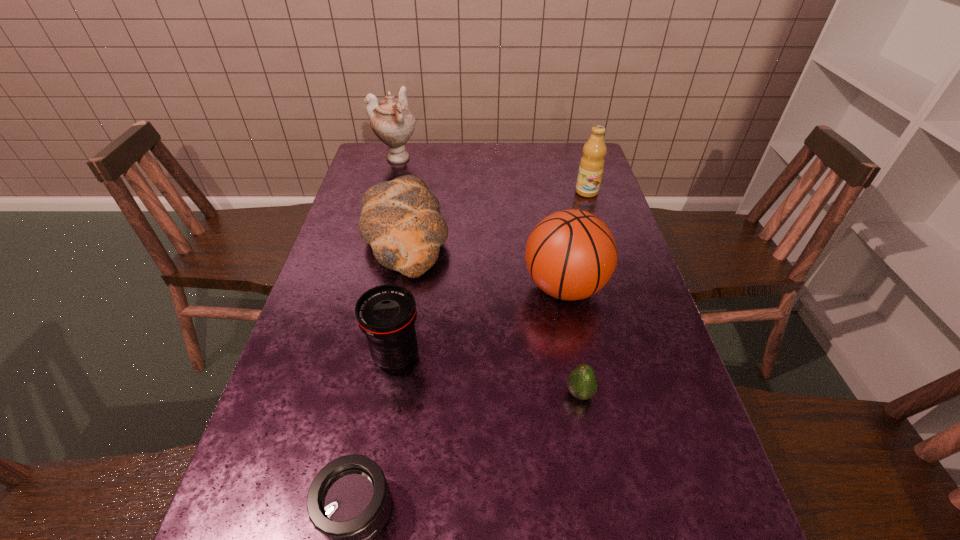
What are the coordinates of `vacant point located 0.300m on the right of the taller telephoto lens` in the screenshot? It's located at (557, 356).

Where is `vacant region located 0.150m on the back of the fifth tallest object`? The image size is (960, 540). vacant region located 0.150m on the back of the fifth tallest object is located at coordinates (417, 173).

You are a GUI agent. You are given a task and a screenshot of the screen. Output one action in this format:
    pyautogui.click(x=<x>, y=<y>)
    Task: Click on the free space located 0.070m on the back of the avocado
    
    Given the screenshot: What is the action you would take?
    (572, 354)

The image size is (960, 540). Identify the location of object that is at the far edge. (392, 122).

I want to click on urn that is at the left edge, so click(392, 122).

You are a GUI agent. You are given a task and a screenshot of the screen. Output one action in this format:
    pyautogui.click(x=<x>, y=<y>)
    Task: Click on the bread at the left edge
    This screenshot has width=960, height=540.
    Given the screenshot: What is the action you would take?
    400,219

Where is `olive oil located in the right edge section of the desktop`? olive oil located in the right edge section of the desktop is located at coordinates (591, 167).

Locate an element on the screen. basketball that is at the right edge is located at coordinates (571, 254).

In order to click on object that is at the far left corner in this screenshot , I will do `click(392, 122)`.

This screenshot has width=960, height=540. Identify the location of vacant space at the far edge of the desktop. (423, 162).